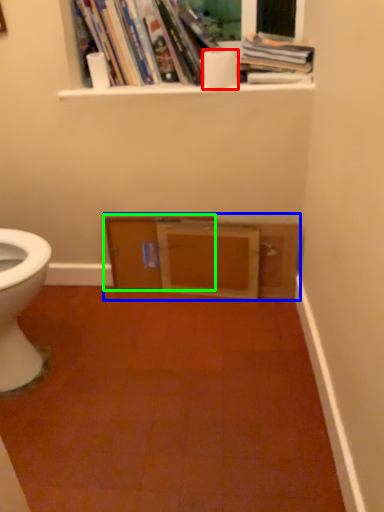
Question: Which object is positioned farthest from toilet paper (highlighted by a red box)? Select from entertainment center (highlighted by a blue box) and file cabinet (highlighted by a green box).

Choices:
 (A) entertainment center
 (B) file cabinet

Answer: (B)